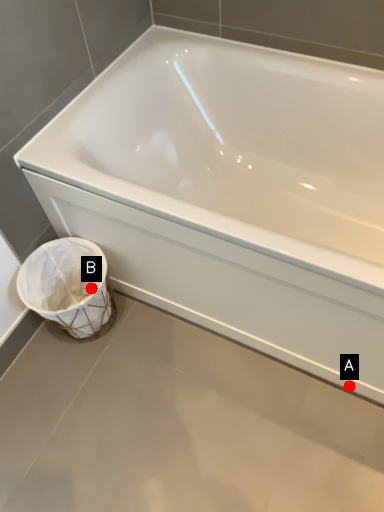
Question: Two points are circled on the image, labeled by A and B beside each circle. Which point is further to the camera?

Choices:
 (A) A is further
 (B) B is further

Answer: (B)